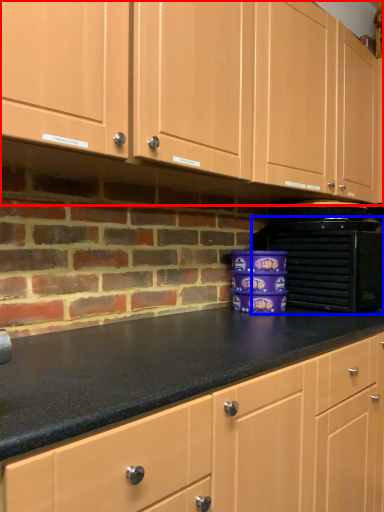
Question: Which object is closer to the camera taking this photo, cabinetry (highlighted by a red box) or home appliance (highlighted by a blue box)?

Choices:
 (A) cabinetry
 (B) home appliance

Answer: (A)